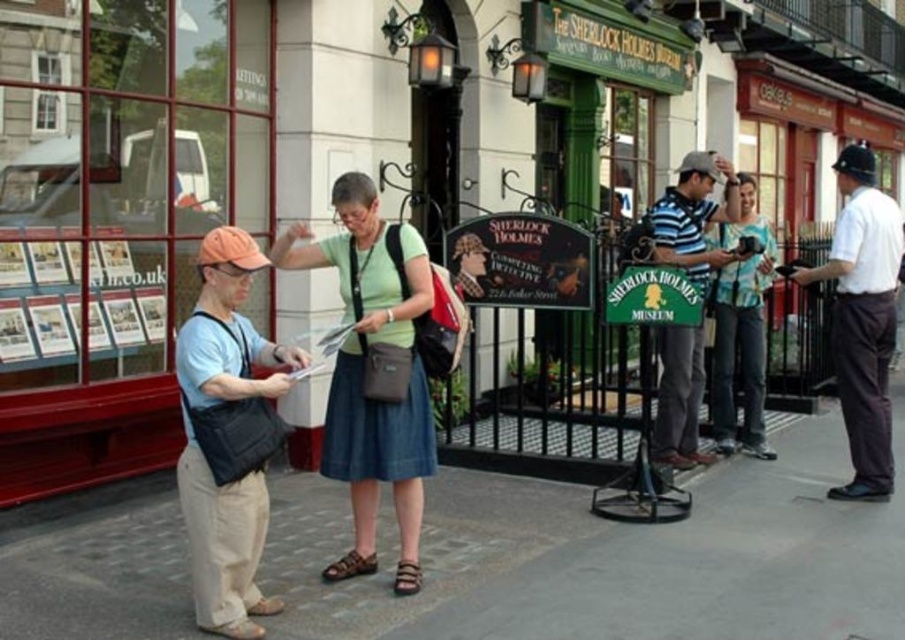
You are a visitor standing in front of the Sherlock Holmes Museum. You see the gray concrete pavement at center and the striped polo shirt at center. Which object is larger in size?

The striped polo shirt at center is larger than the gray concrete pavement at center.

Consider the image. You are standing in front of the Sherlock Holmes Museum and see a green fabric skirt at center. Where exactly is the green fabric skirt located in terms of coordinates?

The green fabric skirt at center is located at point (368, 372).